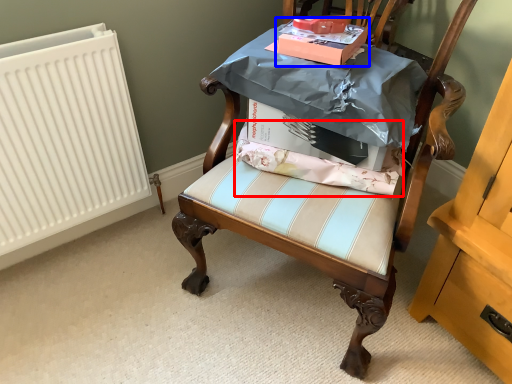
Question: Which of the following is the closest to the observer, fabric (highlighted by a red box) or cardboard box (highlighted by a blue box)?

Choices:
 (A) fabric
 (B) cardboard box

Answer: (B)